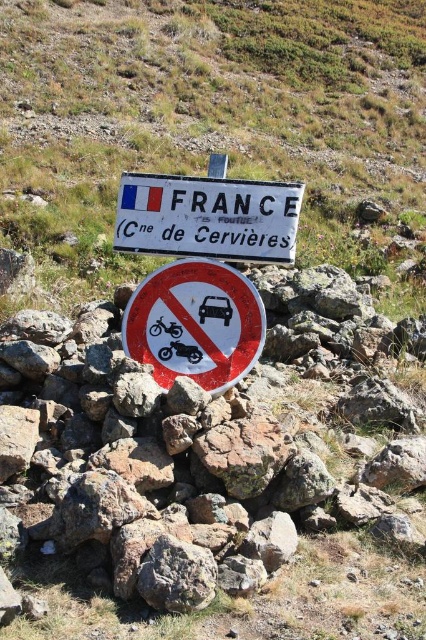
Question: Which of these objects is positioned closest to the white plastic sign at upper center?

Choices:
 (A) brown rocky hillside at center
 (B) white plastic sign at center
 (C) metallic reflective sign at center

Answer: (B)

Question: Is brown rocky hillside at center below metallic reflective sign at center?

Choices:
 (A) yes
 (B) no

Answer: (B)

Question: From the image, what is the correct spatial relationship of white plastic sign at center in relation to metallic reflective sign at center?

Choices:
 (A) right
 (B) left

Answer: (A)

Question: Which point is farther to the camera?

Choices:
 (A) white plastic sign at upper center
 (B) white plastic sign at center
 (C) metallic reflective sign at center
 (D) brown rocky hillside at center

Answer: (D)

Question: Is brown rocky hillside at center above metallic reflective sign at center?

Choices:
 (A) yes
 (B) no

Answer: (A)

Question: Which point is farther from the camera taking this photo?

Choices:
 (A) (158, 250)
 (B) (34, 164)
 (C) (238, 378)
 (D) (215, 355)

Answer: (B)